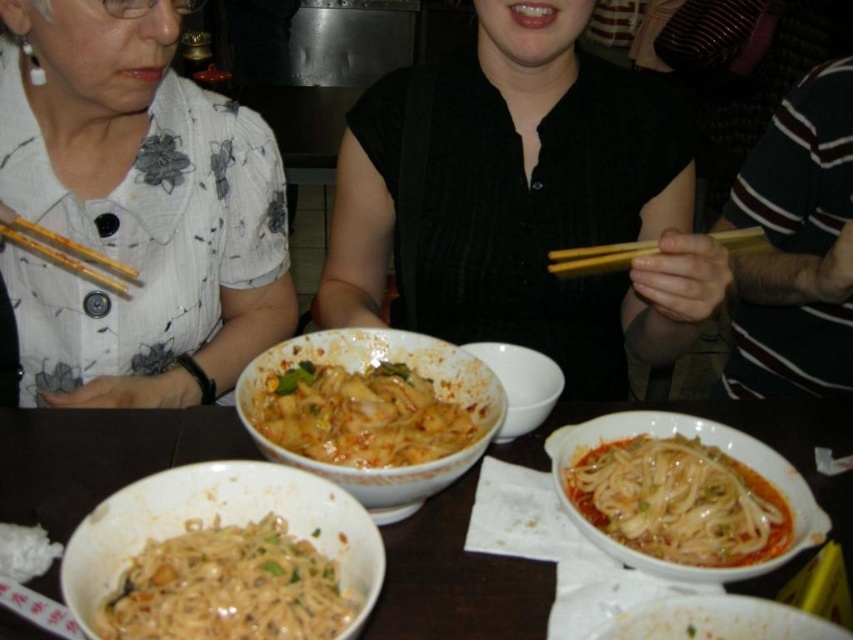
You are a waiter standing at the edge of the table. You need to place a new dish exactly where the matte white bowl at lower center is currently located. Where should you place the new dish on the table?

You should place the new dish at the coordinates point (718, 620) where the matte white bowl at lower center is currently located.

You are a diner sitting at the table and want to reach for the matte white bowl at lower center and the matte ceramic bowl at center. Which bowl can you grab first without moving your chair?

The matte white bowl at lower center is closer to the viewer, so you can grab it first without moving your chair.